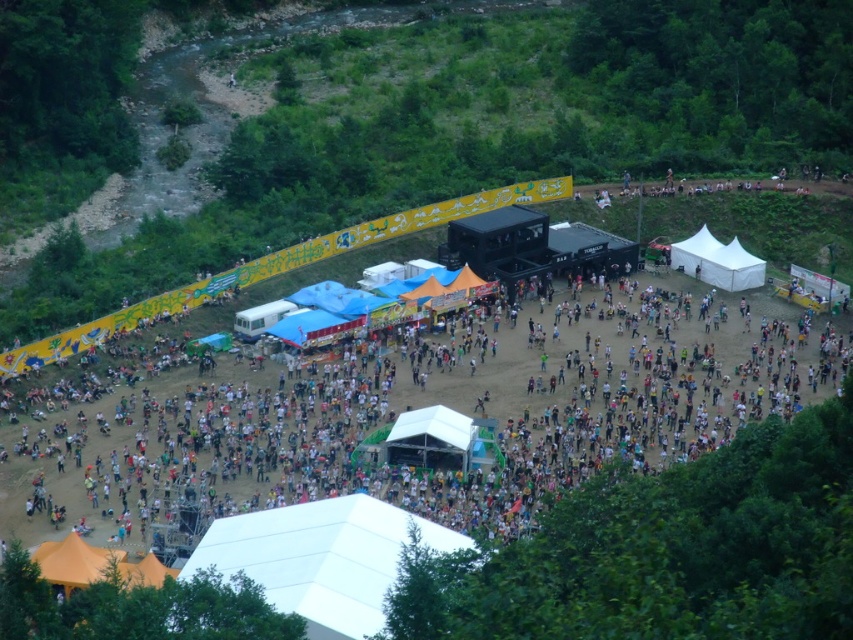
Question: Which of these objects is positioned closest to the white matte canopy at lower center?

Choices:
 (A) white fabric canopy at center-right
 (B) white matte tent at center

Answer: (B)

Question: Considering the real-world distances, which object is closest to the white fabric canopy at center-right?

Choices:
 (A) white matte tent at center
 (B) white matte canopy at lower center

Answer: (A)

Question: Is white matte tent at center further to camera compared to white fabric canopy at center-right?

Choices:
 (A) no
 (B) yes

Answer: (A)

Question: Can you confirm if white matte canopy at lower center is bigger than white fabric canopy at center-right?

Choices:
 (A) yes
 (B) no

Answer: (A)

Question: Is white matte canopy at lower center below white fabric canopy at center-right?

Choices:
 (A) yes
 (B) no

Answer: (A)

Question: Among these objects, which one is nearest to the camera?

Choices:
 (A) white matte tent at center
 (B) white matte canopy at lower center
 (C) white fabric canopy at center-right

Answer: (B)